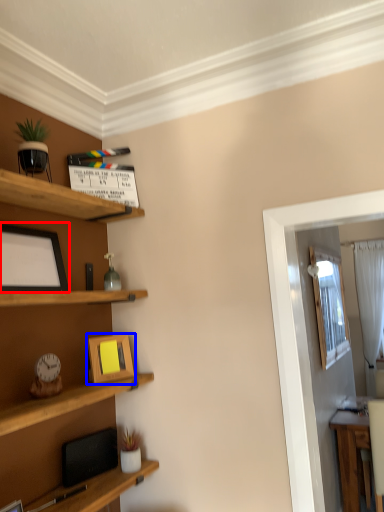
Question: Which object is further to the camera taking this photo, picture frame (highlighted by a red box) or picture frame (highlighted by a blue box)?

Choices:
 (A) picture frame
 (B) picture frame

Answer: (B)